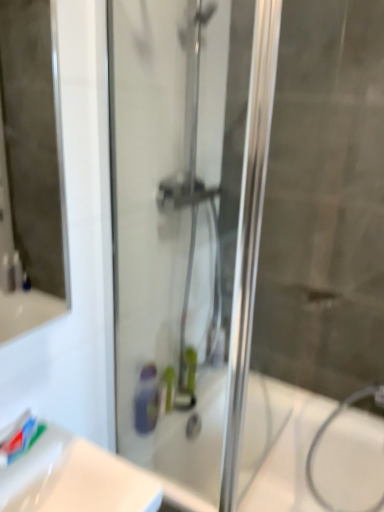
Question: Can you confirm if white glossy bath at center is positioned to the left of white glossy sink at lower left?

Choices:
 (A) no
 (B) yes

Answer: (A)

Question: Considering the relative sizes of white glossy bath at center and white glossy sink at lower left in the image provided, is white glossy bath at center thinner than white glossy sink at lower left?

Choices:
 (A) yes
 (B) no

Answer: (B)

Question: Is the depth of white glossy bath at center less than that of white glossy sink at lower left?

Choices:
 (A) yes
 (B) no

Answer: (B)

Question: From the image's perspective, is white glossy bath at center under white glossy sink at lower left?

Choices:
 (A) yes
 (B) no

Answer: (A)

Question: Is white glossy sink at lower left completely or partially inside white glossy bath at center?

Choices:
 (A) no
 (B) yes

Answer: (A)

Question: Can you confirm if white glossy bath at center is positioned to the right of white glossy sink at lower left?

Choices:
 (A) yes
 (B) no

Answer: (A)

Question: Are transparent glass shower door at center and white glossy bath at center far apart?

Choices:
 (A) no
 (B) yes

Answer: (A)

Question: Does transparent glass shower door at center have a lesser width compared to white glossy bath at center?

Choices:
 (A) no
 (B) yes

Answer: (B)

Question: From the image's perspective, is transparent glass shower door at center above white glossy bath at center?

Choices:
 (A) no
 (B) yes

Answer: (B)

Question: Is transparent glass shower door at center smaller than white glossy bath at center?

Choices:
 (A) yes
 (B) no

Answer: (A)

Question: Does transparent glass shower door at center come behind white glossy bath at center?

Choices:
 (A) yes
 (B) no

Answer: (B)

Question: From a real-world perspective, is transparent glass shower door at center positioned over white glossy bath at center based on gravity?

Choices:
 (A) no
 (B) yes

Answer: (B)

Question: Is white glossy bath at center at the left side of white matte toothpaste at lower left?

Choices:
 (A) yes
 (B) no

Answer: (B)